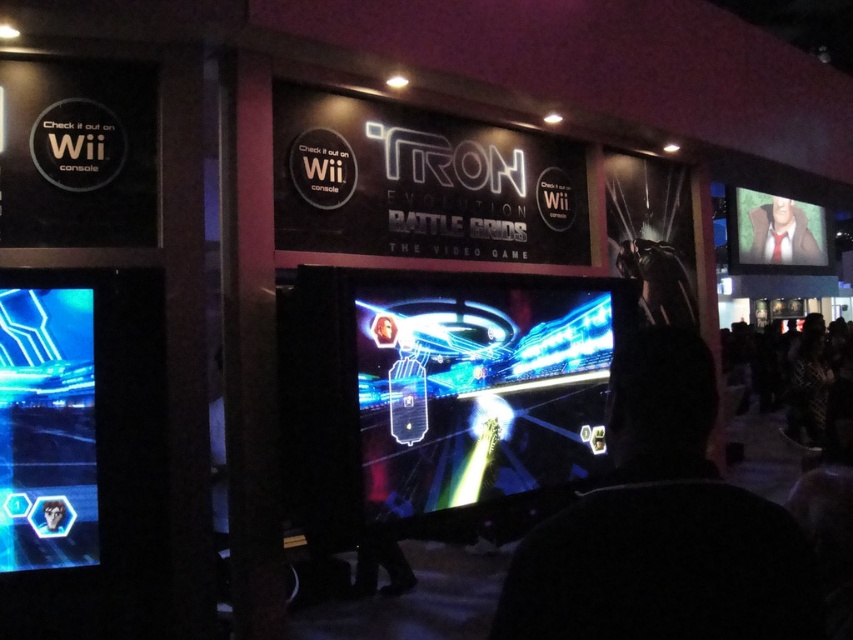
Question: Which of the following is the farthest from the observer?

Choices:
 (A) glossy plastic screen at lower left
 (B) smooth tan suit at upper right
 (C) black fabric at center

Answer: (B)

Question: Is neon glossy game at center bigger than smooth tan suit at upper right?

Choices:
 (A) no
 (B) yes

Answer: (A)

Question: Among these objects, which one is nearest to the camera?

Choices:
 (A) black fabric at center
 (B) glossy plastic screen at lower left

Answer: (A)

Question: Does black fabric at center have a larger size compared to glossy plastic screen at lower left?

Choices:
 (A) yes
 (B) no

Answer: (A)

Question: Which point appears farthest from the camera in this image?

Choices:
 (A) (758, 556)
 (B) (433, 408)
 (C) (33, 490)
 (D) (782, 243)

Answer: (D)

Question: Can you confirm if neon glossy game at center is wider than glossy plastic screen at lower left?

Choices:
 (A) no
 (B) yes

Answer: (B)